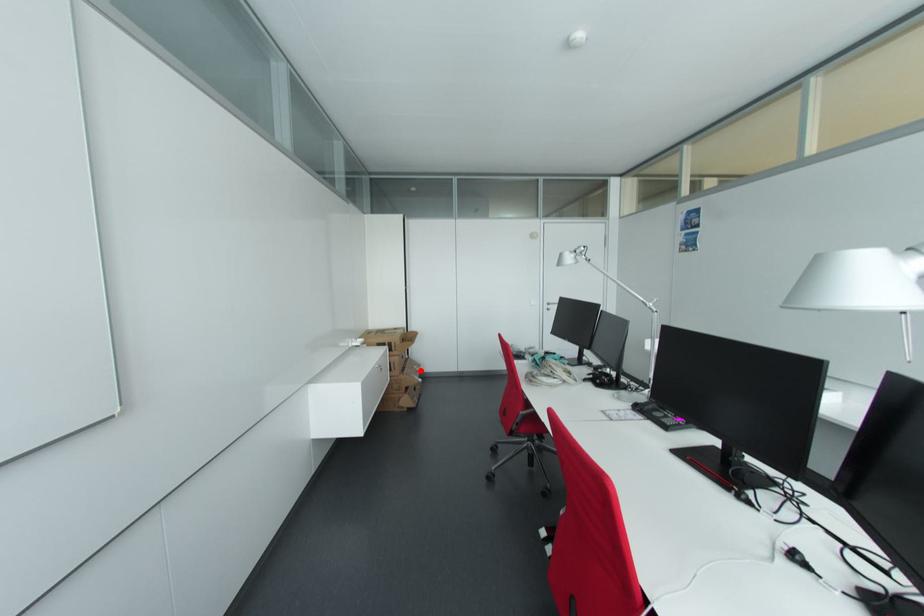
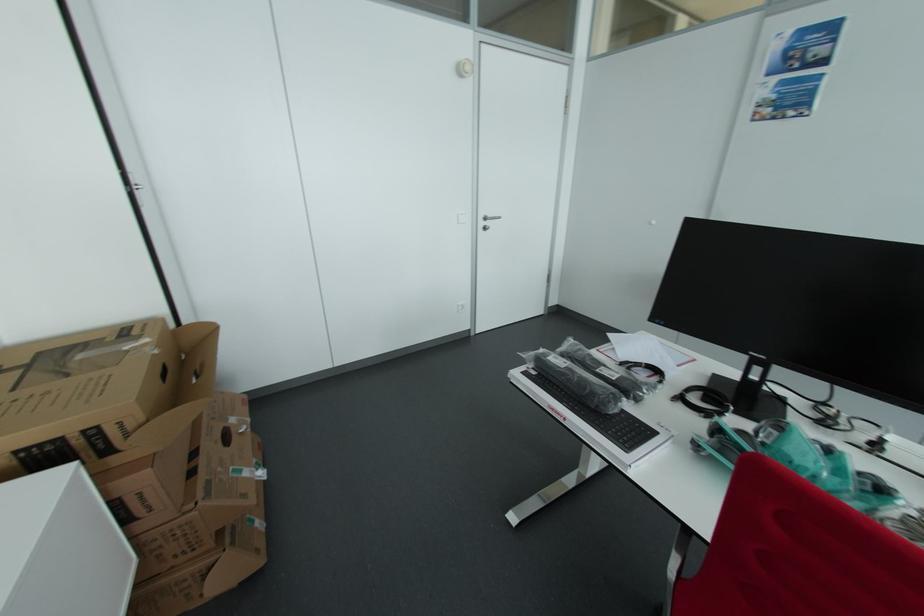
Question: I am providing you with two images of the same scene from different viewpoints. In image1, a red point is highlighted. Considering the same 3D point in image2, which of the following is correct?

Choices:
 (A) It is closer
 (B) It is farther

Answer: (A)